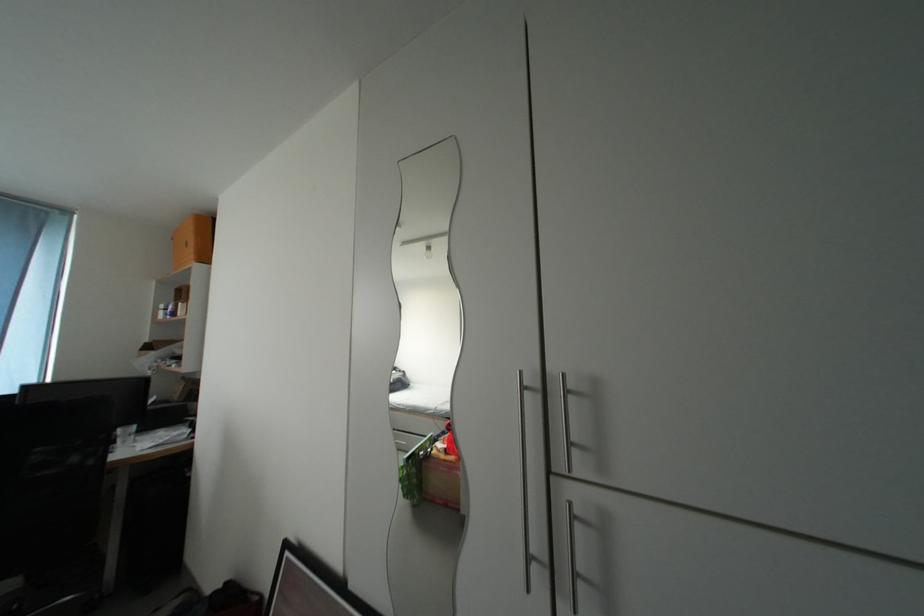
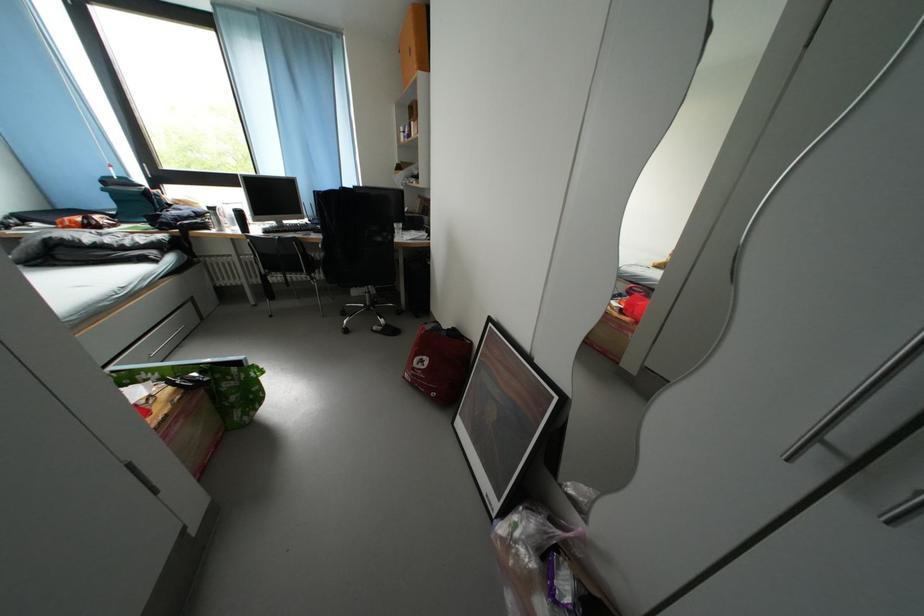
In the second image, find the point that corresponds to point 201,261 in the first image.

(423, 71)